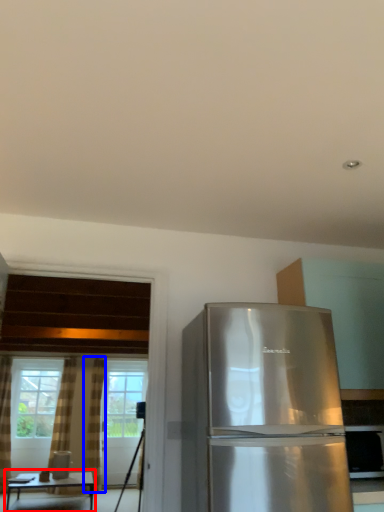
Question: Which object is further to the camera taking this photo, table (highlighted by a red box) or curtain (highlighted by a blue box)?

Choices:
 (A) table
 (B) curtain

Answer: (B)